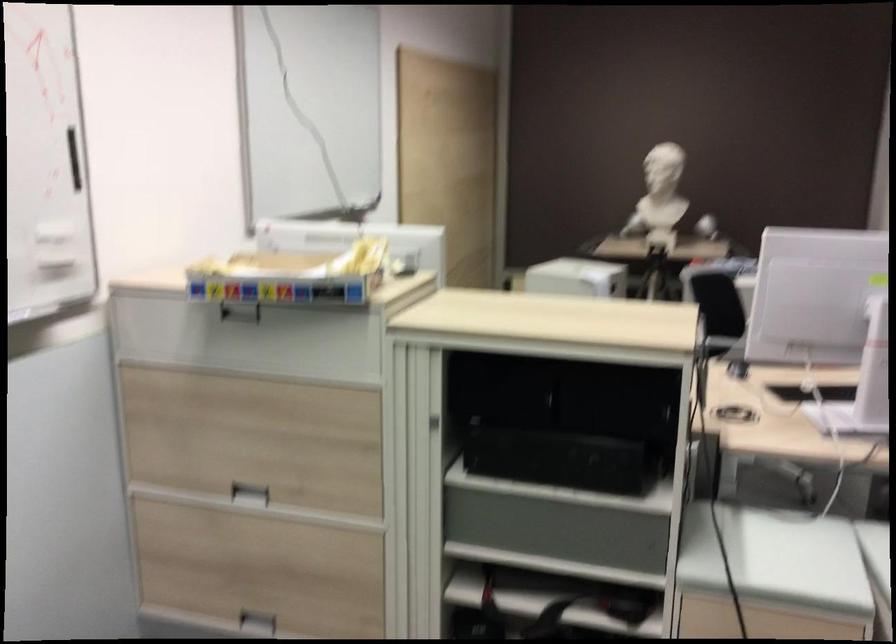
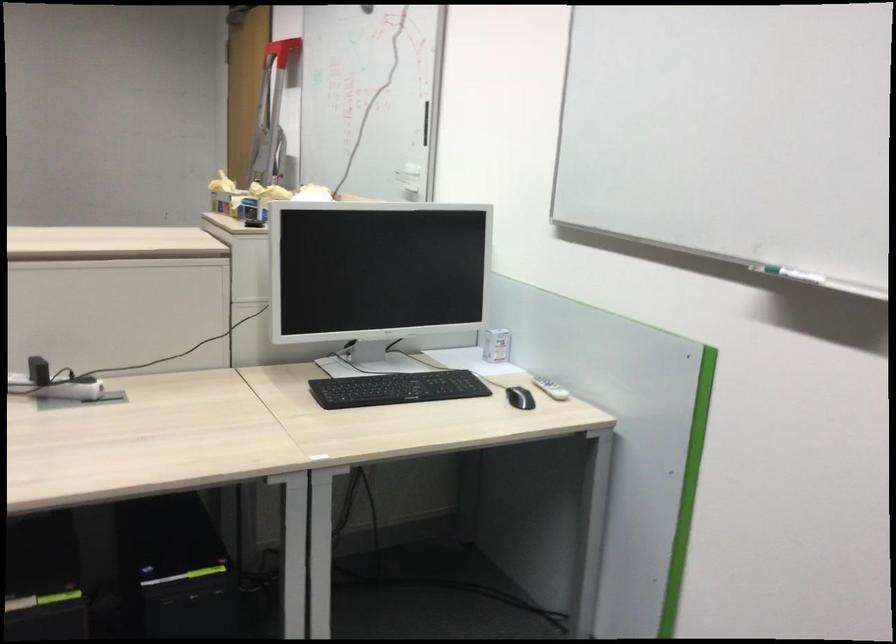
Question: I am providing you with two images of the same scene from different viewpoints. Please identify which objects are invisible in image2.

Choices:
 (A) black brake lever
 (B) whiteboard handle
 (C) white power adapter
 (D) recessed drawer handle

Answer: (D)